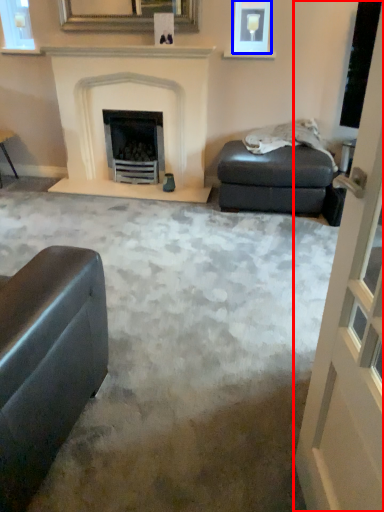
Question: Which point is closer to the camera, screen door (highlighted by a red box) or picture frame (highlighted by a blue box)?

Choices:
 (A) screen door
 (B) picture frame

Answer: (A)